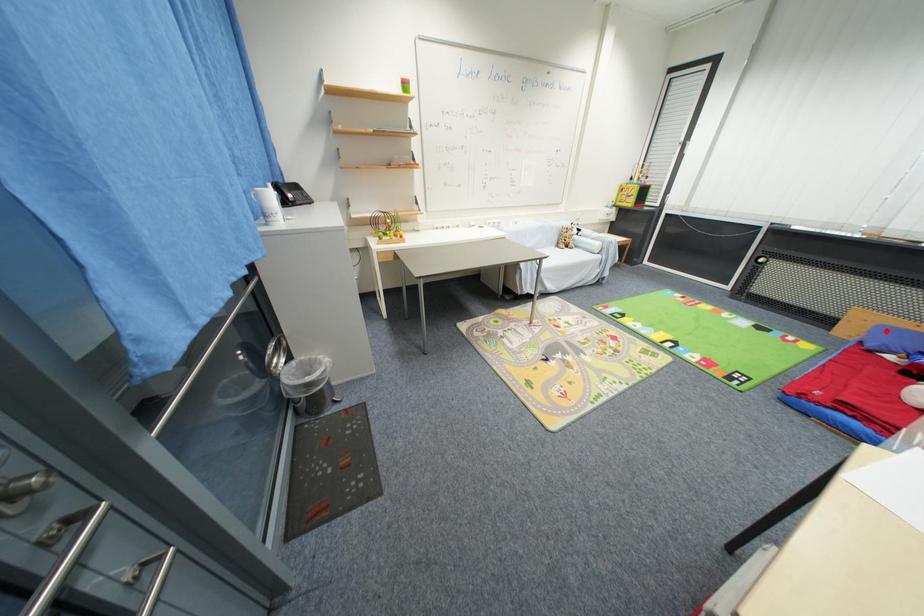
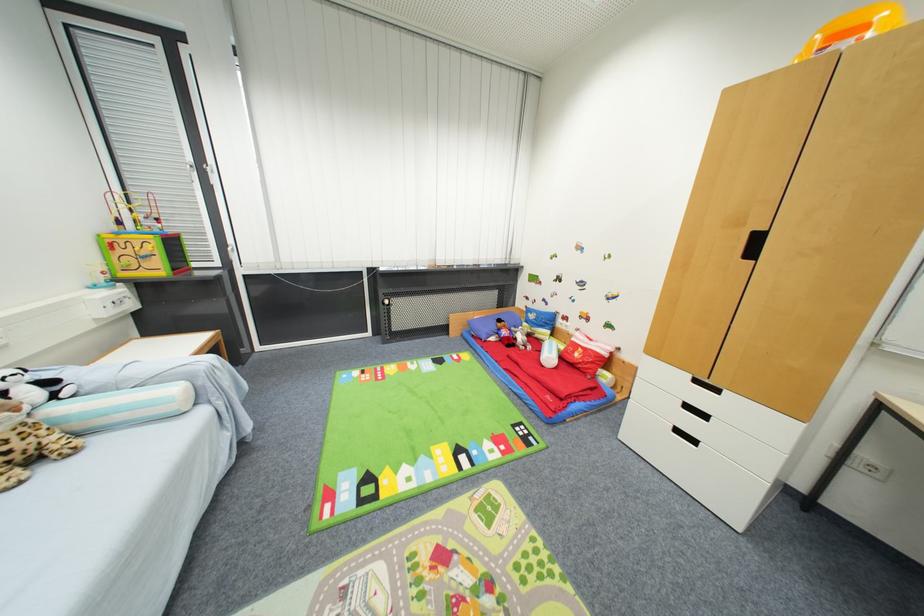
Question: A red point is marked in image1. In image2, is the corresponding 3D point closer to the camera or farther? Reply with the corresponding letter.

Choices:
 (A) The corresponding 3D point is closer.
 (B) The corresponding 3D point is farther.

Answer: (A)